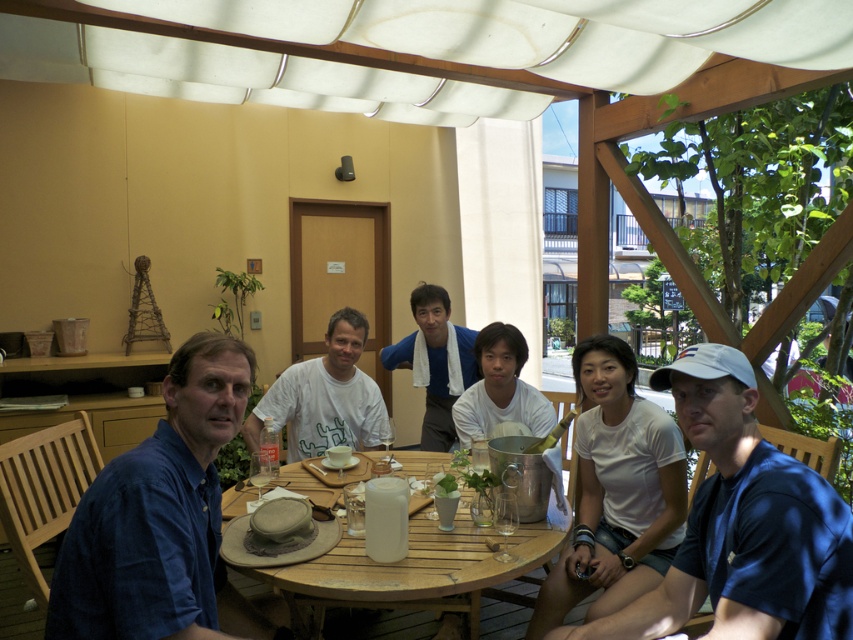
You are a photographer at the event and want to take a photo of the blue fabric cap at right and the white cotton shirt at center. Since you can only focus on one object at a time, which one should you focus on first to ensure it is in the foreground?

The blue fabric cap at right is positioned on the right side of white cotton shirt at center, so you should focus on the blue fabric cap at right first to ensure it is in the foreground.

You are a photographer trying to capture a closeup of the white cotton shirt at center and the white cotton towel at center. Which object should you focus on first to ensure it appears sharp in the photo?

The white cotton shirt at center is closer to the viewer than the white cotton towel at center, so you should focus on the white cotton shirt at center first to ensure it appears sharp.